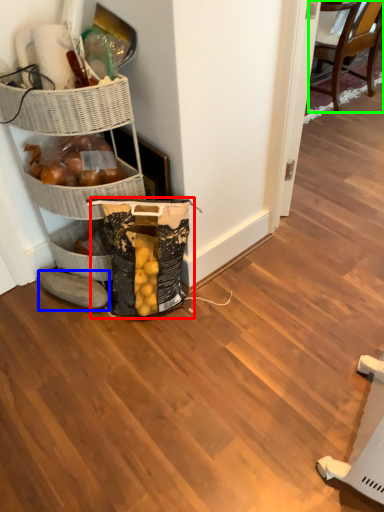
Question: Which object is positioned closest to grocery bag (highlighted by a red box)? Select from footwear (highlighted by a blue box) and chair (highlighted by a green box).

Choices:
 (A) footwear
 (B) chair

Answer: (A)